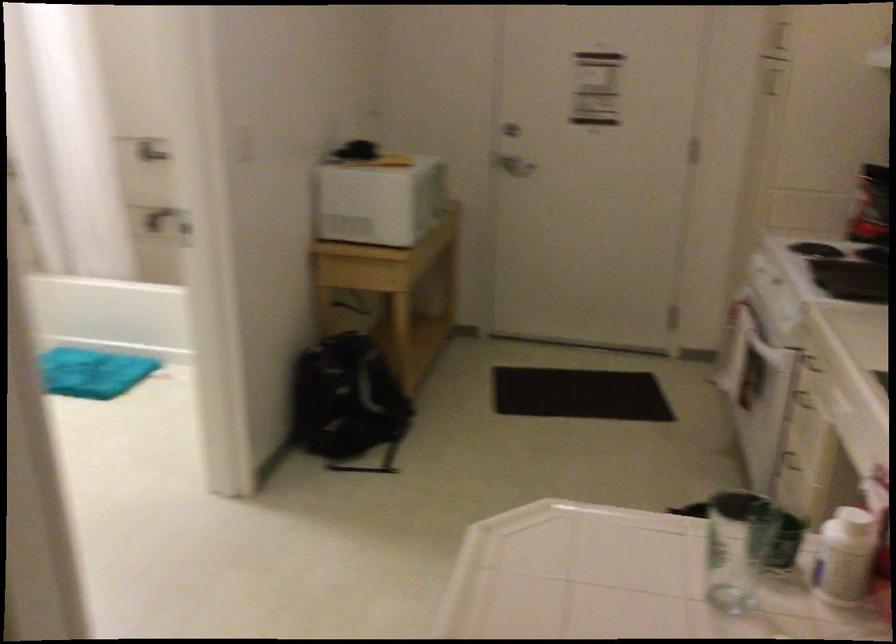
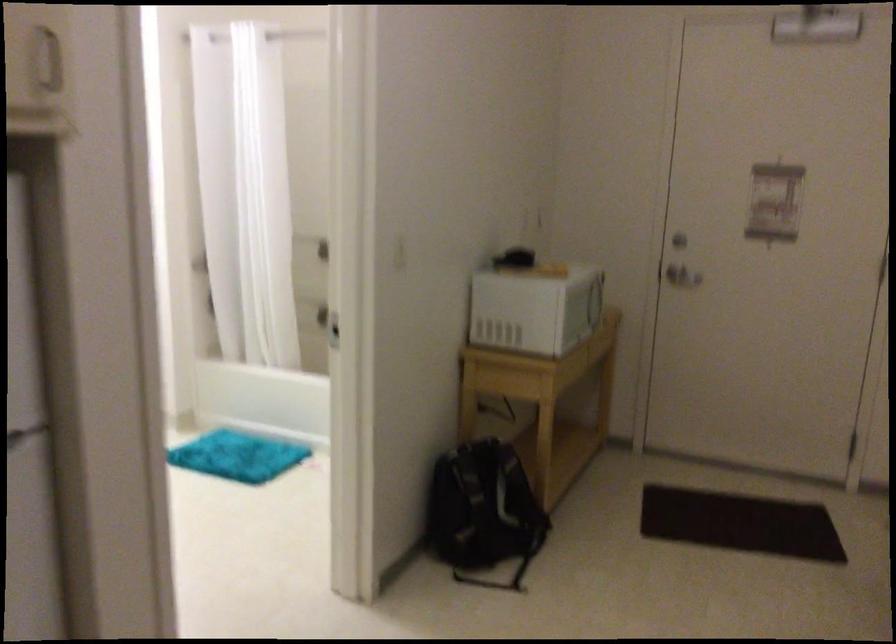
Which direction would the cameraman need to move to produce the second image?

The cameraman walked toward right, forward.